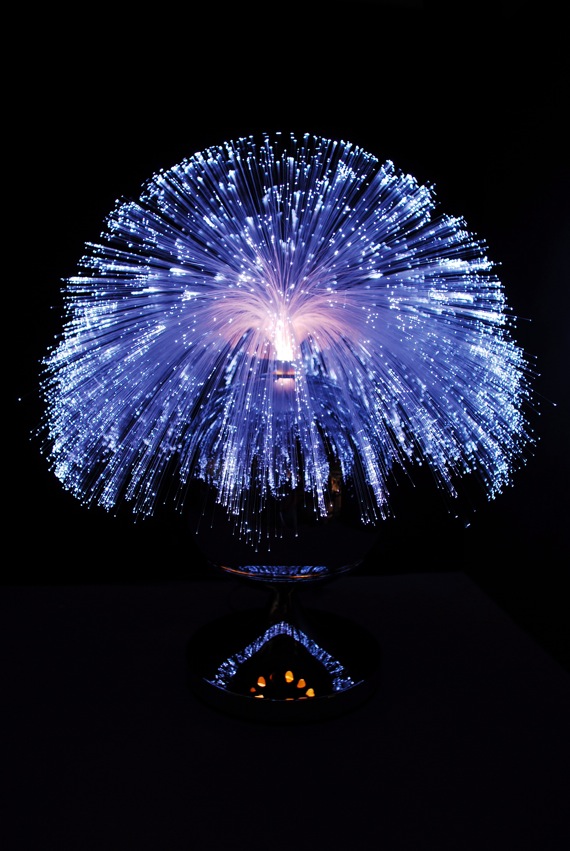
Locate an element on the screen. The height and width of the screenshot is (851, 570). orange lights is located at coordinates (291, 675), (301, 683), (309, 692), (258, 683).